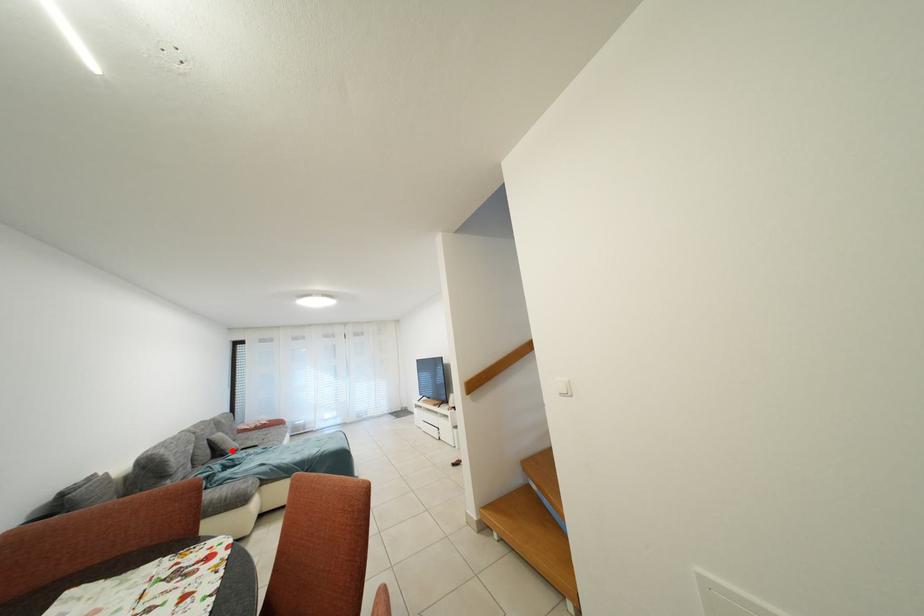
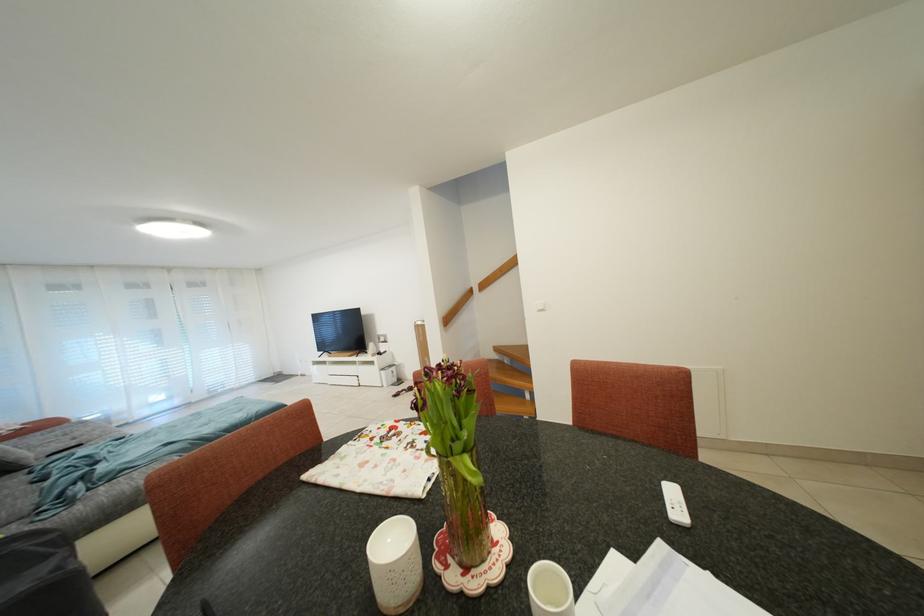
Question: A red point is marked in image1. In image2, is the corresponding 3D point closer to the camera or farther? Reply with the corresponding letter.

Choices:
 (A) The corresponding 3D point is closer.
 (B) The corresponding 3D point is farther.

Answer: (B)